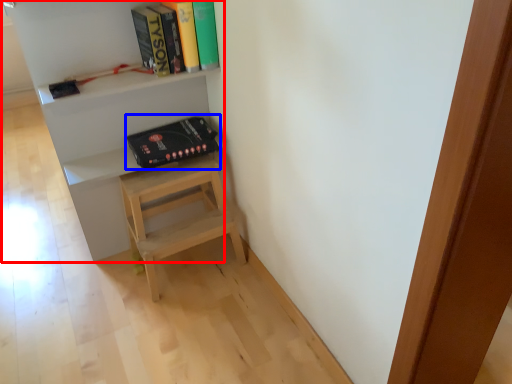
Question: Among these objects, which one is farthest to the camera, shelf (highlighted by a red box) or paperback book (highlighted by a blue box)?

Choices:
 (A) shelf
 (B) paperback book

Answer: (B)